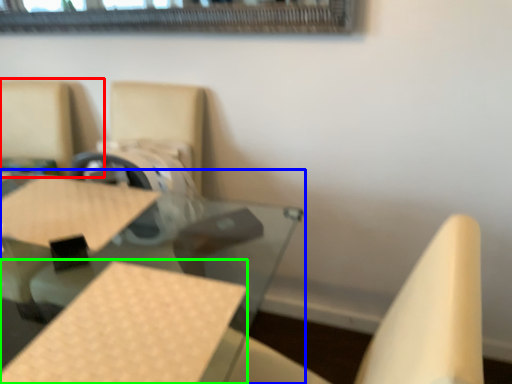
Question: Which object is the closest to the chair (highlighted by a red box)? Choose among these: table (highlighted by a blue box) or plywood (highlighted by a green box).

Choices:
 (A) table
 (B) plywood

Answer: (A)